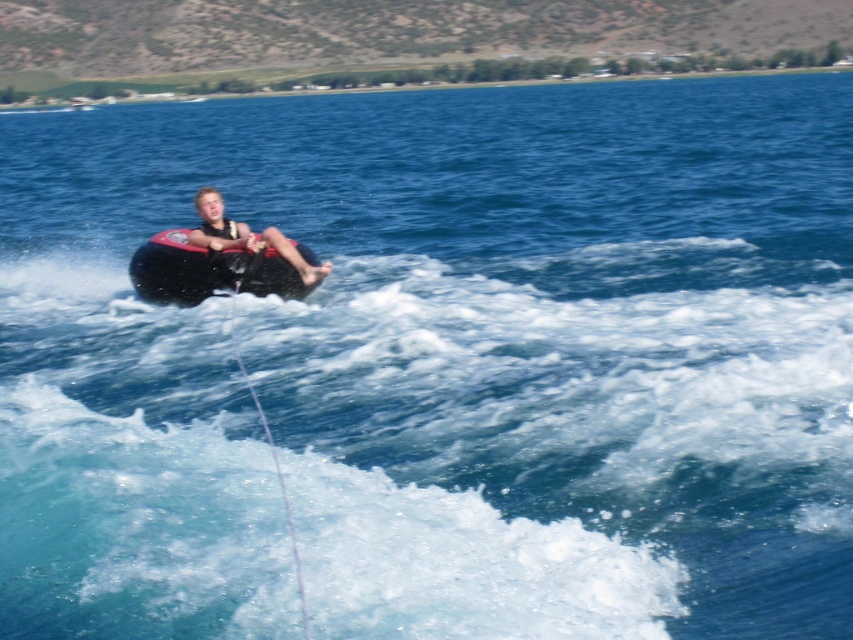
Is black rubber tube at center taller than white string at center?

No.

Based on the photo, can you confirm if black rubber tube at center is smaller than white string at center?

Correct, black rubber tube at center occupies less space than white string at center.

Is point (207, 264) positioned behind point (229, 308)?

No.

At what (x,y) coordinates should I click in order to perform the action: click on black rubber tube at center. Please return your answer as a coordinate pair (x, y). The image size is (853, 640). Looking at the image, I should click on (207, 272).

Can you confirm if black rubber tube at center is positioned to the left of matte black tube at center?

Indeed, black rubber tube at center is positioned on the left side of matte black tube at center.

Is point (160, 300) farther from viewer compared to point (292, 244)?

Yes.

Describe the element at coordinates (207, 272) in the screenshot. I see `black rubber tube at center` at that location.

Where is `black rubber tube at center`? The height and width of the screenshot is (640, 853). black rubber tube at center is located at coordinates 207,272.

Can you confirm if matte black tube at center is positioned to the right of white string at center?

Incorrect, matte black tube at center is not on the right side of white string at center.

Looking at this image, does matte black tube at center lie behind white string at center?

That is True.

Locate an element on the screen. The image size is (853, 640). matte black tube at center is located at coordinates (247, 236).